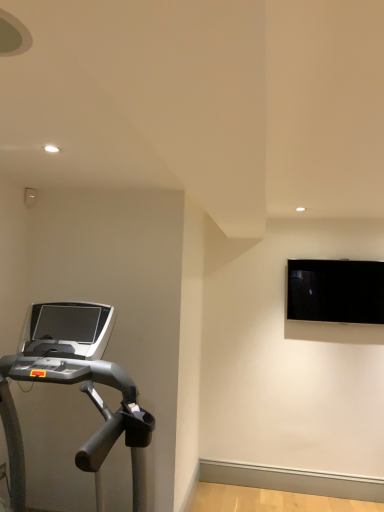
Question: Is silver metallic treadmill at left at the left side of black glossy monitor at upper right?

Choices:
 (A) yes
 (B) no

Answer: (A)

Question: Is silver metallic treadmill at left shorter than black glossy monitor at upper right?

Choices:
 (A) no
 (B) yes

Answer: (A)

Question: Considering the relative sizes of silver metallic treadmill at left and black glossy monitor at upper right in the image provided, is silver metallic treadmill at left thinner than black glossy monitor at upper right?

Choices:
 (A) yes
 (B) no

Answer: (B)

Question: From the image's perspective, is silver metallic treadmill at left located beneath black glossy monitor at upper right?

Choices:
 (A) yes
 (B) no

Answer: (A)

Question: From a real-world perspective, does silver metallic treadmill at left sit lower than black glossy monitor at upper right?

Choices:
 (A) yes
 (B) no

Answer: (A)

Question: Could you tell me if silver metallic treadmill at left is turned towards black glossy monitor at upper right?

Choices:
 (A) no
 (B) yes

Answer: (A)

Question: Would you say black glossy monitor at upper right contains silver metallic treadmill at left?

Choices:
 (A) yes
 (B) no

Answer: (B)

Question: From the image's perspective, does black glossy monitor at upper right appear higher than silver metallic treadmill at left?

Choices:
 (A) no
 (B) yes

Answer: (B)

Question: Does black glossy monitor at upper right have a greater width compared to silver metallic treadmill at left?

Choices:
 (A) no
 (B) yes

Answer: (A)

Question: Is the position of black glossy monitor at upper right more distant than that of silver metallic treadmill at left?

Choices:
 (A) yes
 (B) no

Answer: (A)

Question: Is black glossy monitor at upper right not inside silver metallic treadmill at left?

Choices:
 (A) no
 (B) yes

Answer: (B)

Question: From the image's perspective, is black glossy monitor at upper right beneath silver metallic treadmill at left?

Choices:
 (A) yes
 (B) no

Answer: (B)

Question: Does point (29, 329) appear closer or farther from the camera than point (331, 308)?

Choices:
 (A) farther
 (B) closer

Answer: (B)